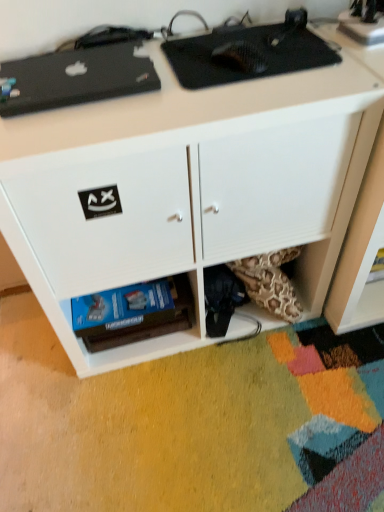
Question: From the image's perspective, is black matte laptop at upper left, positioned as the 1th appliance in left-to-right order, above metallic silver speaker at upper right, the 3th appliance from the left?

Choices:
 (A) yes
 (B) no

Answer: (B)

Question: Considering the relative sizes of black matte laptop at upper left, the third appliance positioned from the right, and metallic silver speaker at upper right, the 3th appliance from the left, in the image provided, is black matte laptop at upper left, the third appliance positioned from the right, bigger than metallic silver speaker at upper right, the 3th appliance from the left,?

Choices:
 (A) no
 (B) yes

Answer: (B)

Question: Is black matte laptop at upper left, positioned as the 1th appliance in left-to-right order, looking in the opposite direction of metallic silver speaker at upper right, the 3th appliance from the left?

Choices:
 (A) no
 (B) yes

Answer: (A)

Question: From the image's perspective, is black matte laptop at upper left, the third appliance positioned from the right, beneath metallic silver speaker at upper right, the 3th appliance from the left?

Choices:
 (A) yes
 (B) no

Answer: (A)

Question: Is the depth of black matte laptop at upper left, the third appliance positioned from the right, less than that of metallic silver speaker at upper right, the 3th appliance from the left?

Choices:
 (A) yes
 (B) no

Answer: (A)

Question: Relative to metallic silver speaker at upper right, placed as the first appliance when sorted from right to left, is white matte desk at upper center in front or behind?

Choices:
 (A) front
 (B) behind

Answer: (A)

Question: Is white matte desk at upper center taller or shorter than metallic silver speaker at upper right, the 3th appliance from the left?

Choices:
 (A) short
 (B) tall

Answer: (B)

Question: Considering the positions of point (288, 91) and point (344, 20), is point (288, 91) closer or farther from the camera than point (344, 20)?

Choices:
 (A) closer
 (B) farther

Answer: (A)

Question: Based on their positions, is white matte desk at upper center located to the left or right of metallic silver speaker at upper right, the 3th appliance from the left?

Choices:
 (A) right
 (B) left

Answer: (B)

Question: From a real-world perspective, is black matte laptop at upper left, positioned as the 1th appliance in left-to-right order, physically located above or below white matte desk at upper center?

Choices:
 (A) above
 (B) below

Answer: (A)

Question: Is black matte laptop at upper left, positioned as the 1th appliance in left-to-right order, taller or shorter than white matte desk at upper center?

Choices:
 (A) tall
 (B) short

Answer: (B)

Question: Considering the positions of point (61, 105) and point (49, 150), is point (61, 105) closer or farther from the camera than point (49, 150)?

Choices:
 (A) farther
 (B) closer

Answer: (A)

Question: From the image's perspective, is black matte laptop at upper left, the third appliance positioned from the right, positioned above or below white matte desk at upper center?

Choices:
 (A) above
 (B) below

Answer: (A)

Question: Is black carbon fiber mouse pad at upper center, arranged as the second appliance when viewed from the left, in front of or behind black matte laptop at upper left, the third appliance positioned from the right, in the image?

Choices:
 (A) front
 (B) behind

Answer: (B)

Question: Based on their sizes in the image, would you say black carbon fiber mouse pad at upper center, the second appliance in the right-to-left sequence, is bigger or smaller than black matte laptop at upper left, positioned as the 1th appliance in left-to-right order?

Choices:
 (A) big
 (B) small

Answer: (B)